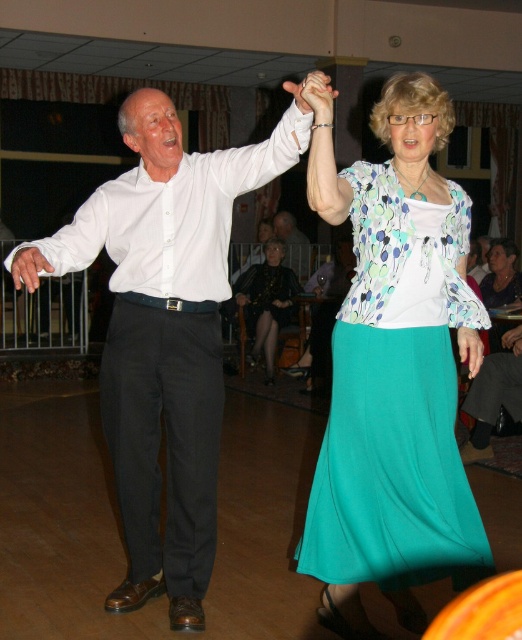
Can you confirm if white smooth shirt at left is shorter than matte white hand at center?

Incorrect, white smooth shirt at left's height does not fall short of matte white hand at center's.

Based on the photo, is white smooth shirt at left to the left of matte white hand at center from the viewer's perspective?

Indeed, white smooth shirt at left is positioned on the left side of matte white hand at center.

You are a GUI agent. You are given a task and a screenshot of the screen. Output one action in this format:
    pyautogui.click(x=<x>, y=<y>)
    Task: Click on the white smooth shirt at left
    Image resolution: width=522 pixels, height=640 pixels.
    Given the screenshot: What is the action you would take?
    pyautogui.click(x=163, y=333)

Find the location of a particular element. This screenshot has height=640, width=522. white smooth shirt at left is located at coordinates (163, 333).

Which is behind, point (453, 276) or point (291, 246)?

Positioned behind is point (291, 246).

Which of these two, teal satin skirt at center or matte black shirt at upper center, stands shorter?

matte black shirt at upper center is shorter.

Does point (370, 348) lie behind point (281, 237)?

No.

At what (x,y) coordinates should I click in order to perform the action: click on teal satin skirt at center. Please return your answer as a coordinate pair (x, y). Image resolution: width=522 pixels, height=640 pixels. Looking at the image, I should click on (395, 413).

Is matte black shirt at upper center above matte white hand at center?

Yes.

Between matte black shirt at upper center and matte white hand at center, which one is positioned lower?

Positioned lower is matte white hand at center.

This screenshot has width=522, height=640. Describe the element at coordinates (292, 244) in the screenshot. I see `matte black shirt at upper center` at that location.

Find the location of `matte black shirt at upper center`. matte black shirt at upper center is located at coordinates 292,244.